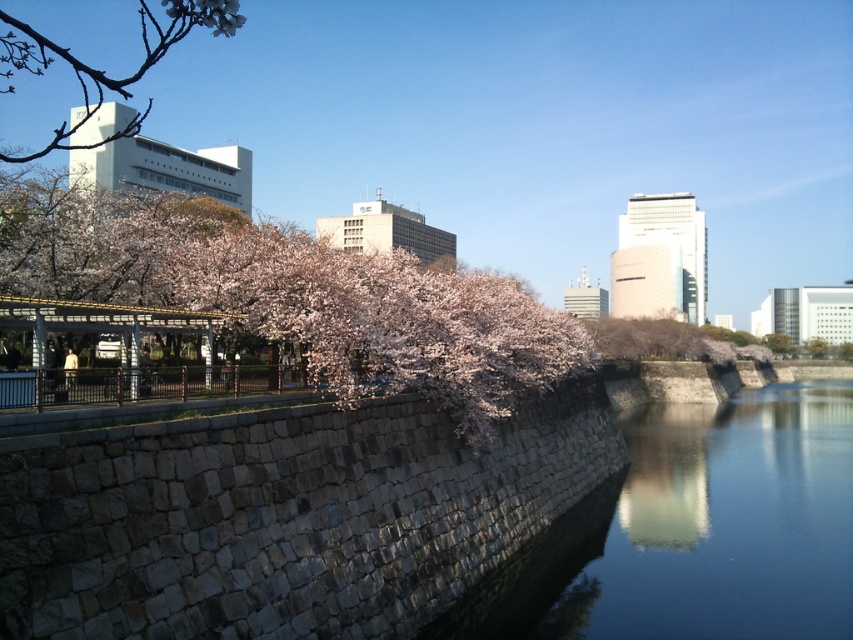
Does point (645, 461) come closer to viewer compared to point (248, 253)?

No.

From the picture: Does smooth stone river at center have a smaller size compared to pink blossoms at left?

Yes, smooth stone river at center is smaller than pink blossoms at left.

You are a GUI agent. You are given a task and a screenshot of the screen. Output one action in this format:
    pyautogui.click(x=<x>, y=<y>)
    Task: Click on the smooth stone river at center
    This screenshot has height=640, width=853.
    Given the screenshot: What is the action you would take?
    pyautogui.click(x=694, y=531)

At what (x,y) coordinates should I click in order to perform the action: click on smooth stone river at center. Please return your answer as a coordinate pair (x, y). This screenshot has width=853, height=640. Looking at the image, I should click on (694, 531).

Who is more distant from viewer, (0, 236) or (196, 22)?

Point (196, 22)

Can you confirm if pink blossoms at left is thinner than pink petal blossom at upper left?

Correct, pink blossoms at left's width is less than pink petal blossom at upper left's.

Is point (189, 236) closer to viewer compared to point (189, 19)?

No.

This screenshot has height=640, width=853. Find the location of `pink blossoms at left`. pink blossoms at left is located at coordinates point(294,294).

Between smooth stone river at center and slightly pinkish-white blossoms at upper left, which one appears on the left side from the viewer's perspective?

slightly pinkish-white blossoms at upper left

Does smooth stone river at center have a greater height compared to slightly pinkish-white blossoms at upper left?

No.

What do you see at coordinates (694, 531) in the screenshot? The width and height of the screenshot is (853, 640). I see `smooth stone river at center` at bounding box center [694, 531].

Find the location of a particular element. The width and height of the screenshot is (853, 640). smooth stone river at center is located at coordinates (694, 531).